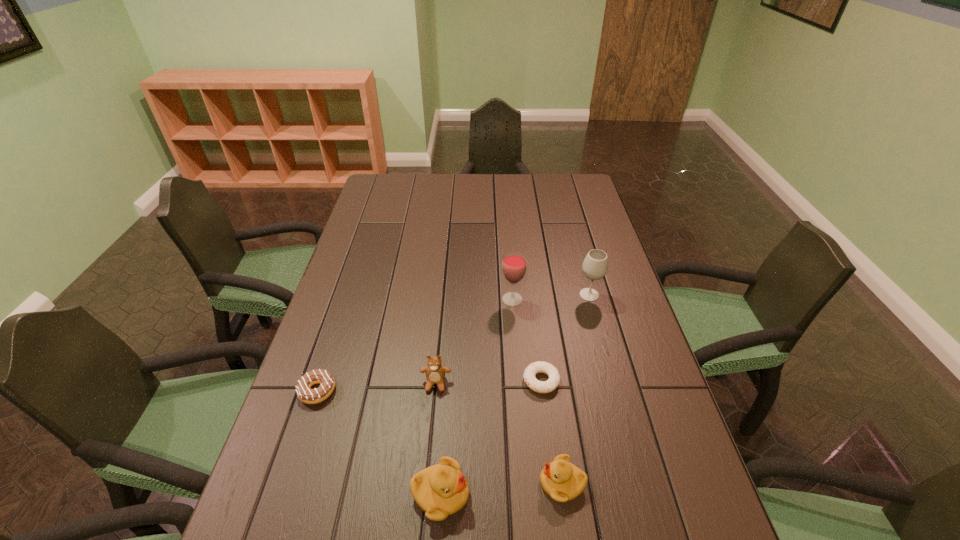
The ducklings are evenly distributed in the image. To maintain this, where would you place another duckling on the right? Please point to a free space. Please provide its 2D coordinates. Your answer should be formatted as a tuple, i.e. [(x, y)], where the tuple contains the x and y coordinates of a point satisfying the conditions above.

[(680, 472)]